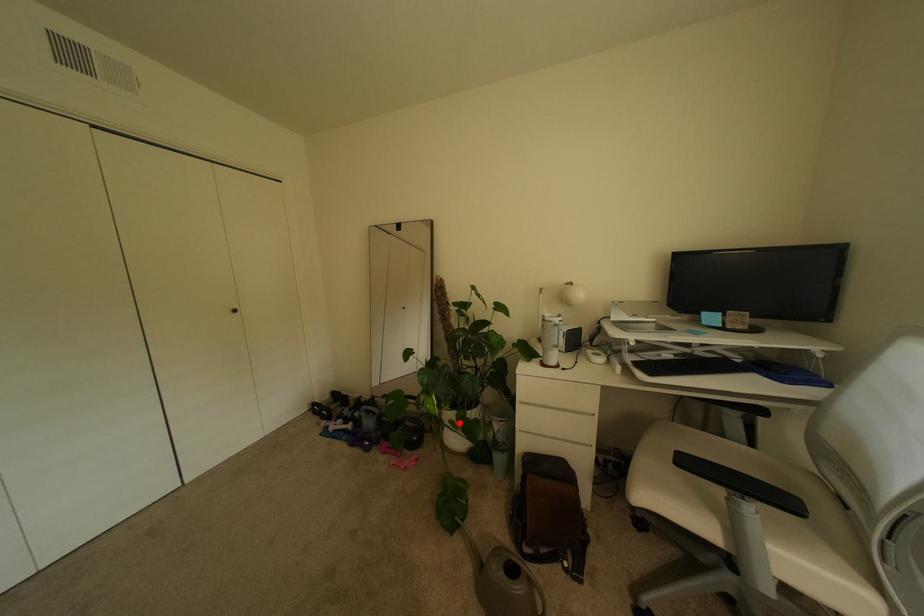
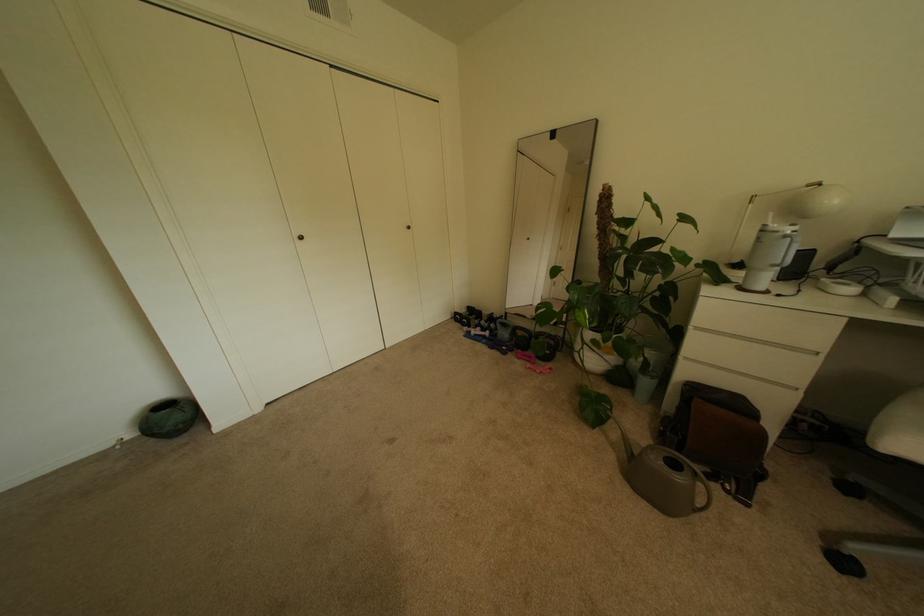
Question: I am providing you with two images of the same scene from different viewpoints. A red point is shown in image1. For the corresponding object point in image2, is it positioned nearer or farther from the camera?

Choices:
 (A) Nearer
 (B) Farther

Answer: (A)